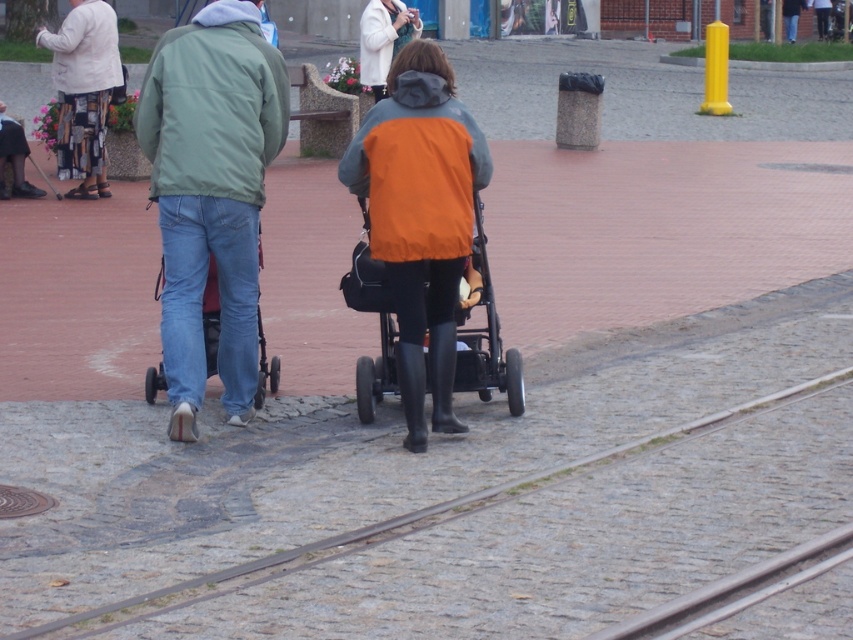
Question: Does orange matte vest at center have a larger size compared to white wool coat at upper center?

Choices:
 (A) no
 (B) yes

Answer: (B)

Question: Among these objects, which one is nearest to the camera?

Choices:
 (A) white textured jacket at upper left
 (B) white wool coat at upper center

Answer: (A)

Question: Which object appears closest to the camera in this image?

Choices:
 (A) green matte jacket at center
 (B) white wool coat at upper center

Answer: (A)

Question: Which of the following is the closest to the observer?

Choices:
 (A) white wool coat at upper center
 (B) white textured jacket at upper left
 (C) green matte jacket at center
 (D) orange matte vest at center

Answer: (D)

Question: In this image, where is green matte jacket at center located relative to orange matte vest at center?

Choices:
 (A) above
 (B) below

Answer: (A)

Question: Is orange matte vest at center smaller than orange fabric stroller at center?

Choices:
 (A) yes
 (B) no

Answer: (B)